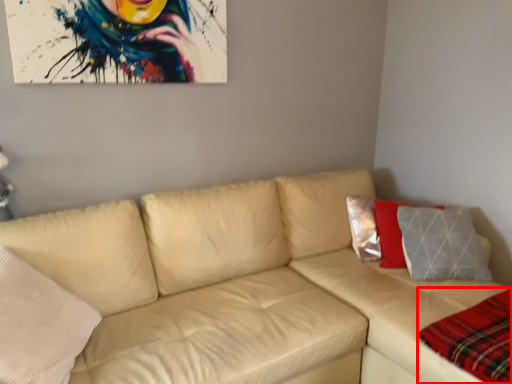
Question: From the image's perspective, what is the correct spatial positioning of plaid (annotated by the red box) in reference to studio couch?

Choices:
 (A) above
 (B) below

Answer: (B)